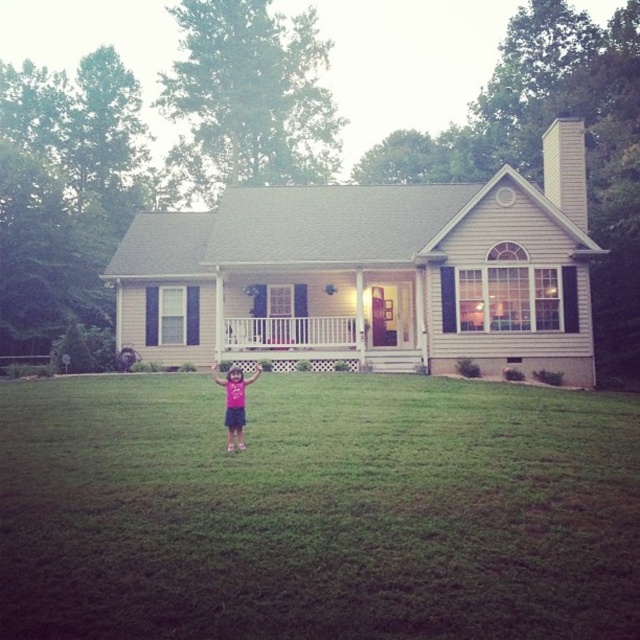
You are planning to host a picnic and need to choose between the green grass at center and the white painted wood porch at center for your picnic spot. Which area has a larger space to accommodate more people?

The green grass at center is bigger than the white painted wood porch at center, so the picnic spot should be placed on the green grass at center to accommodate more people.